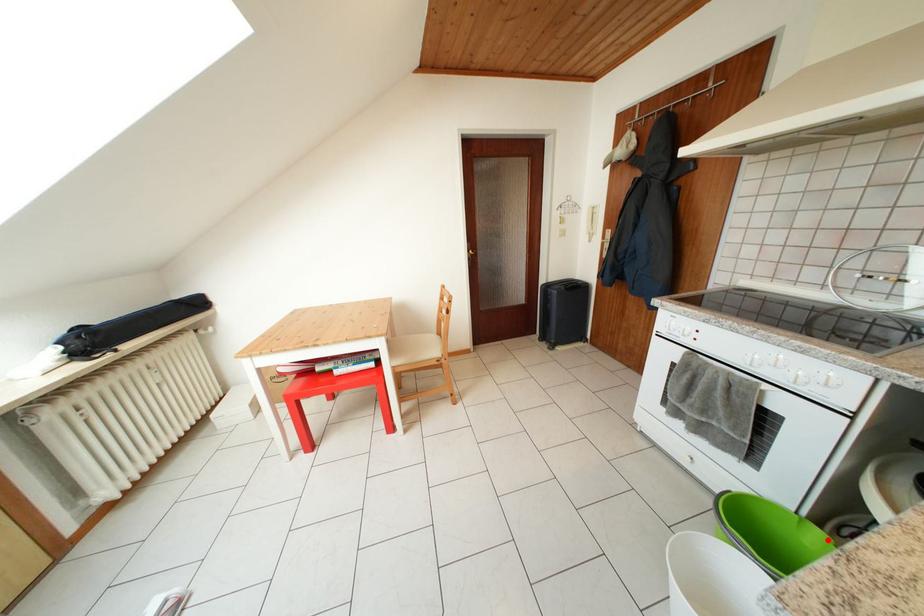
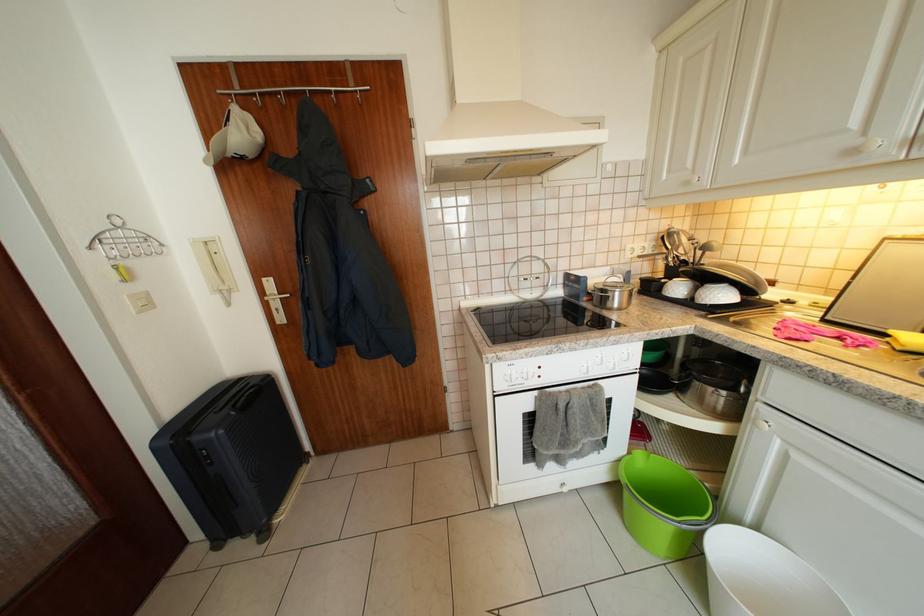
Question: I am providing you with two images of the same scene from different viewpoints. A red point is shown in image1. For the corresponding object point in image2, is it positioned nearer or farther from the camera?

Choices:
 (A) Nearer
 (B) Farther

Answer: (A)